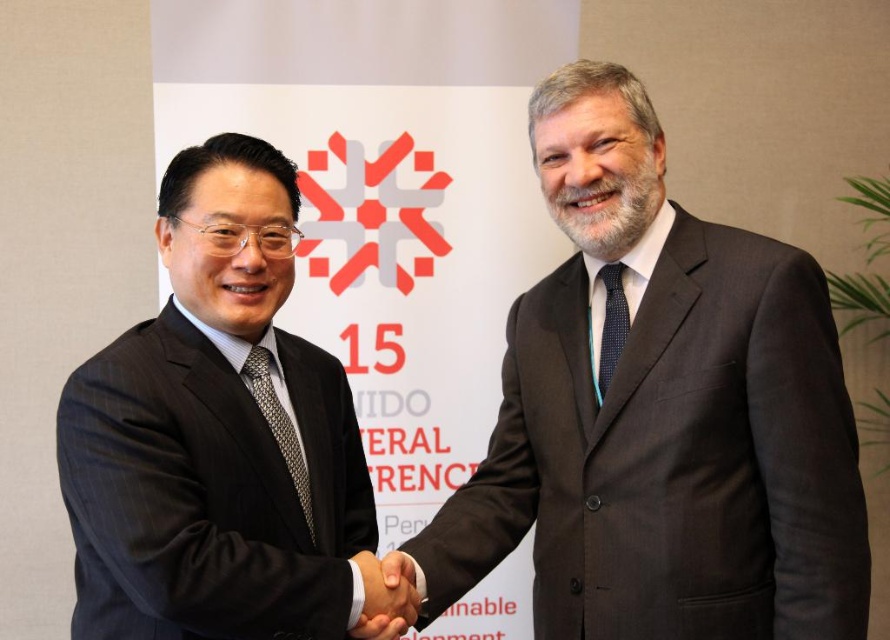
Which of these two, black suit at left or silver metallic tie at center, stands shorter?

silver metallic tie at center

Which is in front, point (231, 616) or point (288, 470)?

Point (231, 616) is in front.

Is point (265, 342) behind point (290, 440)?

Yes.

At what (x,y) coordinates should I click in order to perform the action: click on black suit at left. Please return your answer as a coordinate pair (x, y). The height and width of the screenshot is (640, 890). Looking at the image, I should click on [216, 433].

In the scene shown: Can you confirm if black suit at left is wider than black glossy hand at center?

Correct, the width of black suit at left exceeds that of black glossy hand at center.

Is black suit at left closer to the viewer compared to black glossy hand at center?

Yes, it is.

Does point (263, 218) lie in front of point (374, 627)?

That is False.

In order to click on black suit at left in this screenshot , I will do [216, 433].

Can you confirm if black glossy hand at center is positioned to the right of silver metallic tie at center?

Yes, black glossy hand at center is to the right of silver metallic tie at center.

Between black glossy hand at center and silver metallic tie at center, which one appears on the left side from the viewer's perspective?

silver metallic tie at center is more to the left.

Who is more forward, (377, 614) or (267, 364)?

Point (377, 614) is in front.

Identify the location of black glossy hand at center. (386, 596).